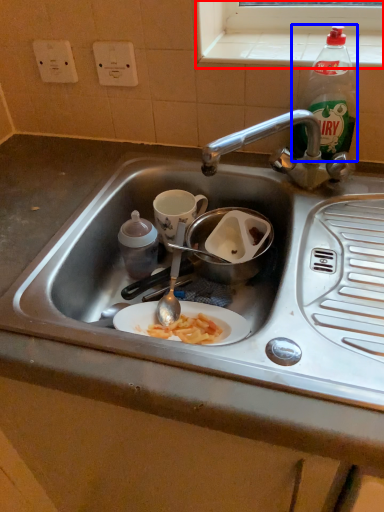
Question: Among these objects, which one is nearest to the camera, window sill (highlighted by a red box) or bottle (highlighted by a blue box)?

Choices:
 (A) window sill
 (B) bottle

Answer: (B)